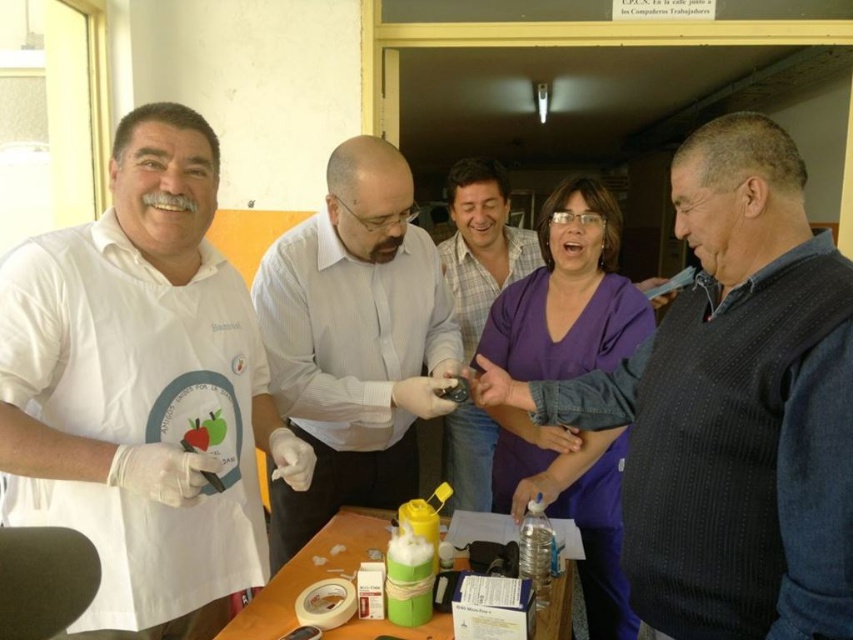
You are standing at the origin point in the image. There are two points marked in the scene. Which point is closer to you, point (112, 403) or point (741, 422)?

Point (741, 422) is closer to you because it is in front of point (112, 403).

Consider the image. Where is the dark blue sweater at center located in the image?

The dark blue sweater at center is located at point 0.637 on the x axis and 0.858 on the y axis.

You are standing in front of the table where the group is gathered. There are two points marked on the table surface at coordinates point [345,141] and point [332,531]. Which point is closer to you?

Point [345,141] is closer to the viewer than point [332,531].